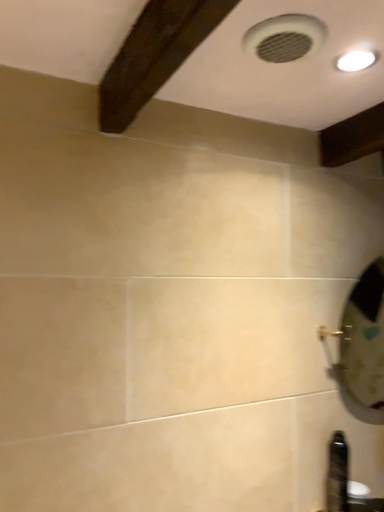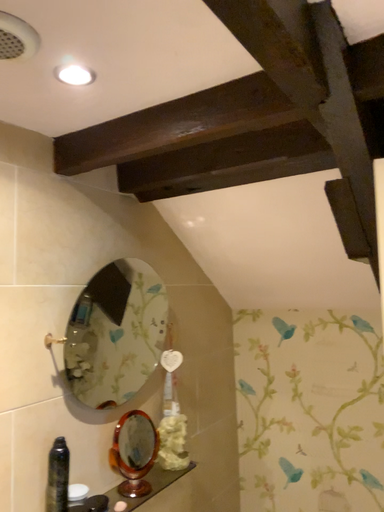
Question: How did the camera likely rotate when shooting the video?

Choices:
 (A) rotated left
 (B) rotated right

Answer: (B)